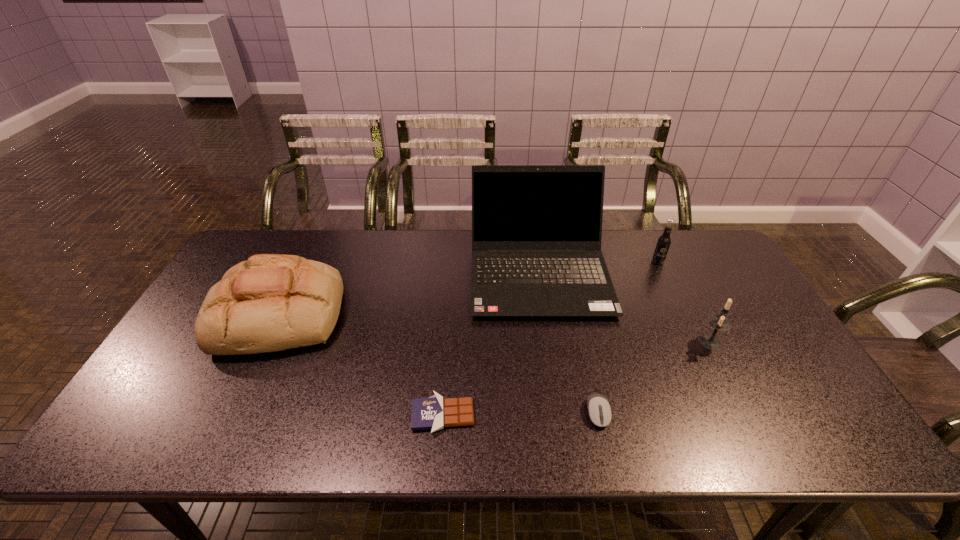
Locate an element on the screen. blank area located on the back of the shortest object is located at coordinates (448, 332).

You are a GUI agent. You are given a task and a screenshot of the screen. Output one action in this format:
    pyautogui.click(x=<x>, y=<y>)
    Task: Click on the laptop computer positioned at the far edge
    
    Given the screenshot: What is the action you would take?
    pyautogui.click(x=536, y=229)

You are a GUI agent. You are given a task and a screenshot of the screen. Output one action in this format:
    pyautogui.click(x=<x>, y=<y>)
    Task: Click on the root beer present at the far edge
    The width and height of the screenshot is (960, 540).
    Given the screenshot: What is the action you would take?
    pyautogui.click(x=663, y=243)

This screenshot has width=960, height=540. I want to click on computer equipment that is at the near edge, so click(x=599, y=410).

Find the location of `chocolate bar that is at the near edge`. chocolate bar that is at the near edge is located at coordinates (435, 413).

At what (x,y) coordinates should I click in order to perform the action: click on object positioned at the left edge. Please return your answer as a coordinate pair (x, y). The height and width of the screenshot is (540, 960). Looking at the image, I should click on (271, 302).

You are a GUI agent. You are given a task and a screenshot of the screen. Output one action in this format:
    pyautogui.click(x=<x>, y=<y>)
    Task: Click on the free region at the far edge of the desktop
    The image size is (960, 540).
    Given the screenshot: What is the action you would take?
    pyautogui.click(x=453, y=248)

Identify the location of vacant region at the near edge of the desktop. (598, 428).

In the image, there is a desktop. Where is `free space at the right edge`? Image resolution: width=960 pixels, height=540 pixels. free space at the right edge is located at coordinates (715, 313).

In the image, there is a desktop. Identify the location of vacant space at the far left corner. This screenshot has width=960, height=540. coord(252,244).